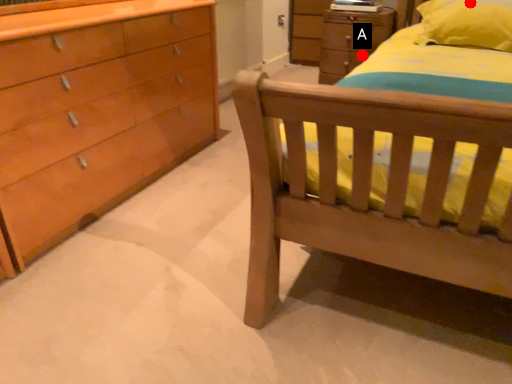
Question: Two points are circled on the image, labeled by A and B beside each circle. Which of the following is the farthest from the observer?

Choices:
 (A) A is further
 (B) B is further

Answer: (A)